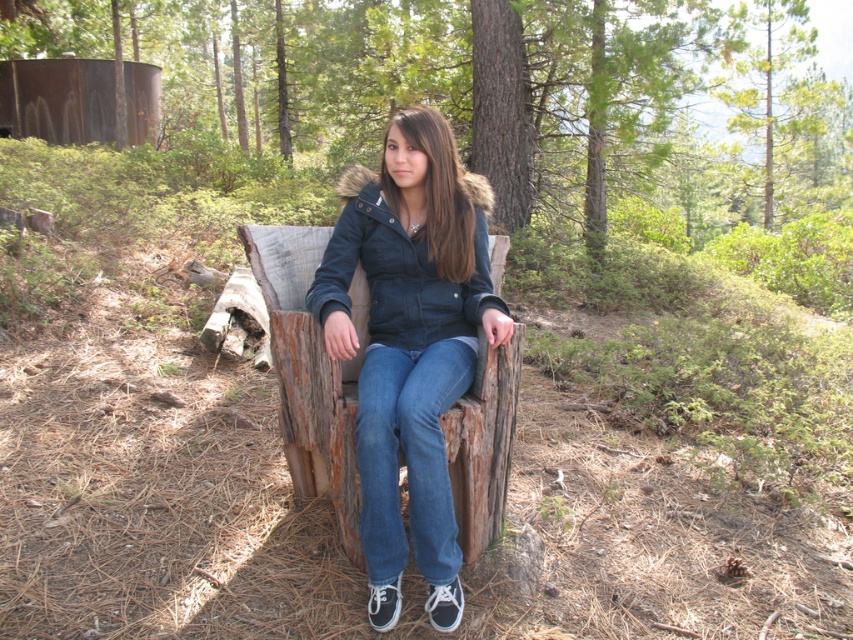
Question: Is denim jacket at center to the right of denim at center from the viewer's perspective?

Choices:
 (A) yes
 (B) no

Answer: (B)

Question: Which object appears farthest from the camera in this image?

Choices:
 (A) denim jacket at center
 (B) denim at center

Answer: (A)

Question: Which of the following is the farthest from the observer?

Choices:
 (A) denim jacket at center
 (B) denim at center

Answer: (A)

Question: Among these objects, which one is farthest from the camera?

Choices:
 (A) denim jacket at center
 (B) denim at center

Answer: (A)

Question: Does denim jacket at center have a larger size compared to denim at center?

Choices:
 (A) no
 (B) yes

Answer: (B)

Question: Does denim jacket at center appear over denim at center?

Choices:
 (A) no
 (B) yes

Answer: (B)